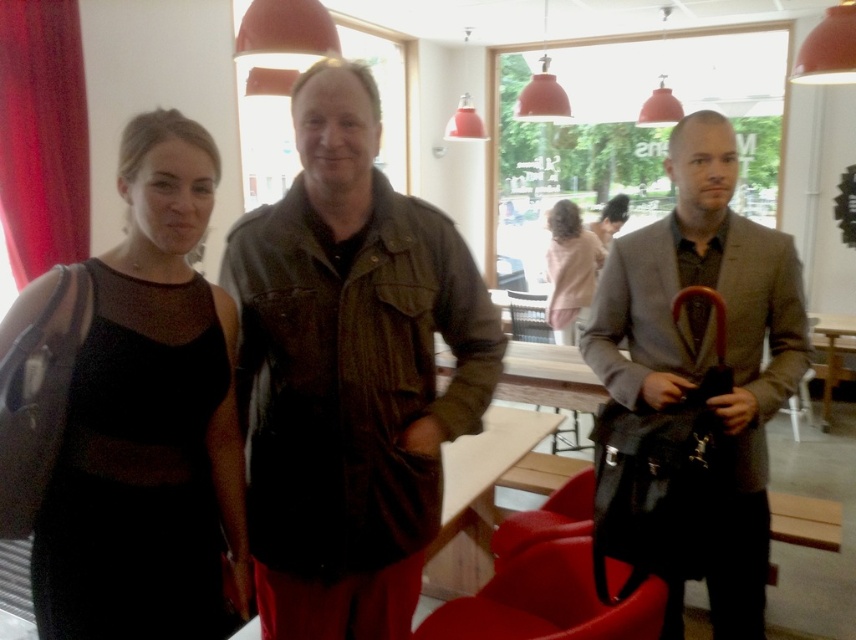
At what (x,y) coordinates should I click in order to perform the action: click on leather jacket at center. Please return your answer as a coordinate pair (x, y). Image resolution: width=856 pixels, height=640 pixels. Looking at the image, I should click on (349, 372).

Can you confirm if leather jacket at center is positioned to the right of matte gray suit at right?

In fact, leather jacket at center is to the left of matte gray suit at right.

Does point (395, 490) lie behind point (732, 524)?

That is False.

At what (x,y) coordinates should I click in order to perform the action: click on leather jacket at center. Please return your answer as a coordinate pair (x, y). The image size is (856, 640). Looking at the image, I should click on (349, 372).

Is point (214, 392) behind point (578, 301)?

No, (214, 392) is in front of (578, 301).

Which is behind, point (82, 433) or point (572, 289)?

The point (572, 289) is behind.

You are a GUI agent. You are given a task and a screenshot of the screen. Output one action in this format:
    pyautogui.click(x=<x>, y=<y>)
    Task: Click on the black matte dress at left
    The height and width of the screenshot is (640, 856).
    Given the screenshot: What is the action you would take?
    pyautogui.click(x=128, y=413)

Does point (203, 566) come in front of point (792, 332)?

Yes, it is in front of point (792, 332).

Image resolution: width=856 pixels, height=640 pixels. Find the location of `black matte dress at left`. black matte dress at left is located at coordinates (128, 413).

Locate an element on the screen. The image size is (856, 640). black matte dress at left is located at coordinates (128, 413).